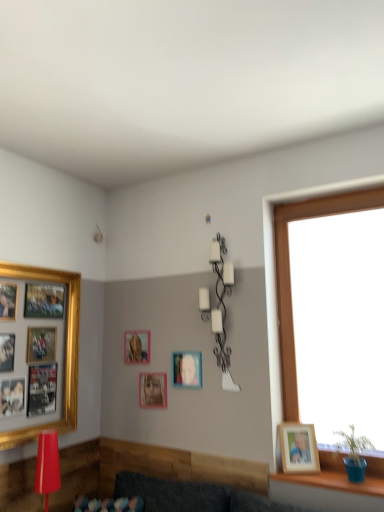
This screenshot has width=384, height=512. What are the coordinates of `free space in front of wooden photo frame at right, which is the 1th picture frame from right to left` in the screenshot? It's located at (307, 476).